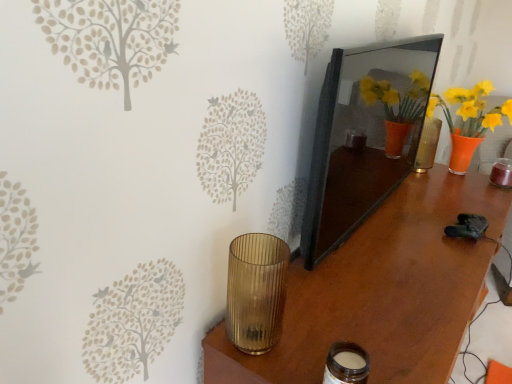
Question: Is gold ribbed glass at lower left, which appears as the 1th candle holder when viewed from the left, not near matte glass jar at lower center, which appears as the second candle holder when viewed from the left?

Choices:
 (A) yes
 (B) no

Answer: (B)

Question: Does gold ribbed glass at lower left, which appears as the 1th candle holder when viewed from the left, come behind matte glass jar at lower center, which appears as the second candle holder when viewed from the left?

Choices:
 (A) yes
 (B) no

Answer: (A)

Question: Considering the relative sizes of gold ribbed glass at lower left, which appears as the 1th candle holder when viewed from the left, and matte glass jar at lower center, which appears as the second candle holder when viewed from the left, in the image provided, is gold ribbed glass at lower left, which appears as the 1th candle holder when viewed from the left, thinner than matte glass jar at lower center, which appears as the second candle holder when viewed from the left,?

Choices:
 (A) yes
 (B) no

Answer: (B)

Question: From a real-world perspective, is gold ribbed glass at lower left, which appears as the 1th candle holder when viewed from the left, physically above matte glass jar at lower center, acting as the first candle holder starting from the right?

Choices:
 (A) no
 (B) yes

Answer: (B)

Question: Is gold ribbed glass at lower left, which appears as the 1th candle holder when viewed from the left, aimed at matte glass jar at lower center, acting as the first candle holder starting from the right?

Choices:
 (A) no
 (B) yes

Answer: (B)

Question: Looking at the image, does matte glass jar at lower center, acting as the first candle holder starting from the right, seem bigger or smaller compared to gold ribbed glass at lower left, placed as the 2th candle holder when sorted from right to left?

Choices:
 (A) big
 (B) small

Answer: (B)

Question: From a real-world perspective, is matte glass jar at lower center, which appears as the second candle holder when viewed from the left, above or below gold ribbed glass at lower left, placed as the 2th candle holder when sorted from right to left?

Choices:
 (A) above
 (B) below

Answer: (B)

Question: Relative to gold ribbed glass at lower left, which appears as the 1th candle holder when viewed from the left, is matte glass jar at lower center, acting as the first candle holder starting from the right, in front or behind?

Choices:
 (A) behind
 (B) front

Answer: (B)

Question: In terms of width, does matte glass jar at lower center, acting as the first candle holder starting from the right, look wider or thinner when compared to gold ribbed glass at lower left, placed as the 2th candle holder when sorted from right to left?

Choices:
 (A) wide
 (B) thin

Answer: (B)

Question: In terms of width, does brown wood table at center look wider or thinner when compared to gold ribbed glass at lower left, which appears as the 1th candle holder when viewed from the left?

Choices:
 (A) wide
 (B) thin

Answer: (A)

Question: From the image's perspective, relative to gold ribbed glass at lower left, which appears as the 1th candle holder when viewed from the left, is brown wood table at center above or below?

Choices:
 (A) above
 (B) below

Answer: (B)

Question: Considering their positions, is brown wood table at center located in front of or behind gold ribbed glass at lower left, placed as the 2th candle holder when sorted from right to left?

Choices:
 (A) front
 (B) behind

Answer: (A)

Question: Does point (473, 266) appear closer or farther from the camera than point (242, 271)?

Choices:
 (A) farther
 (B) closer

Answer: (A)

Question: Considering the positions of point (258, 306) and point (430, 82), is point (258, 306) closer or farther from the camera than point (430, 82)?

Choices:
 (A) farther
 (B) closer

Answer: (B)

Question: Is gold ribbed glass at lower left, placed as the 2th candle holder when sorted from right to left, wider or thinner than matte black mirror at center?

Choices:
 (A) wide
 (B) thin

Answer: (A)